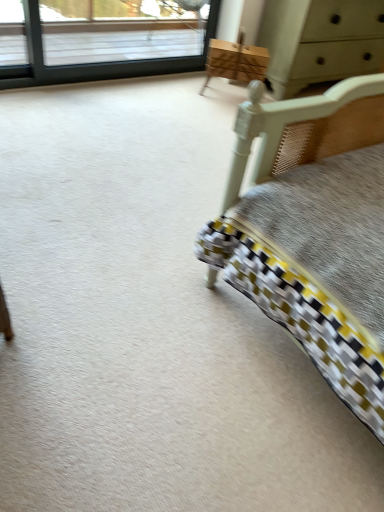
Question: Is wooden chest of drawers at upper center turned away from light gray wood dresser at upper right?

Choices:
 (A) no
 (B) yes

Answer: (A)

Question: Is wooden chest of drawers at upper center bigger than light gray wood dresser at upper right?

Choices:
 (A) no
 (B) yes

Answer: (A)

Question: Is the position of wooden chest of drawers at upper center less distant than that of light gray wood dresser at upper right?

Choices:
 (A) no
 (B) yes

Answer: (A)

Question: From the image's perspective, is wooden chest of drawers at upper center beneath light gray wood dresser at upper right?

Choices:
 (A) yes
 (B) no

Answer: (A)

Question: Is wooden chest of drawers at upper center positioned behind light gray wood dresser at upper right?

Choices:
 (A) no
 (B) yes

Answer: (B)

Question: In terms of height, does light gray wood dresser at upper right look taller or shorter compared to clear glass window at upper left?

Choices:
 (A) tall
 (B) short

Answer: (A)

Question: From a real-world perspective, is light gray wood dresser at upper right physically located above or below clear glass window at upper left?

Choices:
 (A) below
 (B) above

Answer: (B)

Question: Relative to clear glass window at upper left, is light gray wood dresser at upper right in front or behind?

Choices:
 (A) behind
 (B) front

Answer: (A)

Question: Is light gray wood dresser at upper right situated inside clear glass window at upper left or outside?

Choices:
 (A) inside
 (B) outside

Answer: (B)

Question: Is clear glass window at upper left inside the boundaries of light gray wood dresser at upper right, or outside?

Choices:
 (A) outside
 (B) inside

Answer: (A)

Question: From a real-world perspective, is clear glass window at upper left above or below light gray wood dresser at upper right?

Choices:
 (A) above
 (B) below

Answer: (B)

Question: In terms of size, does clear glass window at upper left appear bigger or smaller than light gray wood dresser at upper right?

Choices:
 (A) small
 (B) big

Answer: (A)

Question: From their relative heights in the image, would you say clear glass window at upper left is taller or shorter than light gray wood dresser at upper right?

Choices:
 (A) short
 (B) tall

Answer: (A)

Question: Is point (244, 65) positioned closer to the camera than point (329, 4)?

Choices:
 (A) farther
 (B) closer

Answer: (A)

Question: From a real-world perspective, is wooden chest of drawers at upper center positioned above or below light gray wood dresser at upper right?

Choices:
 (A) above
 (B) below

Answer: (B)